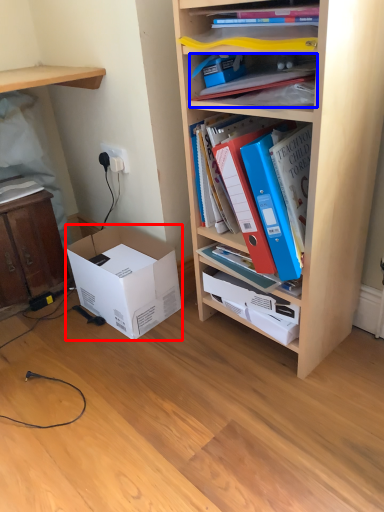
Question: Which of the following is the farthest to the observer, box (highlighted by a red box) or book (highlighted by a blue box)?

Choices:
 (A) box
 (B) book

Answer: (A)